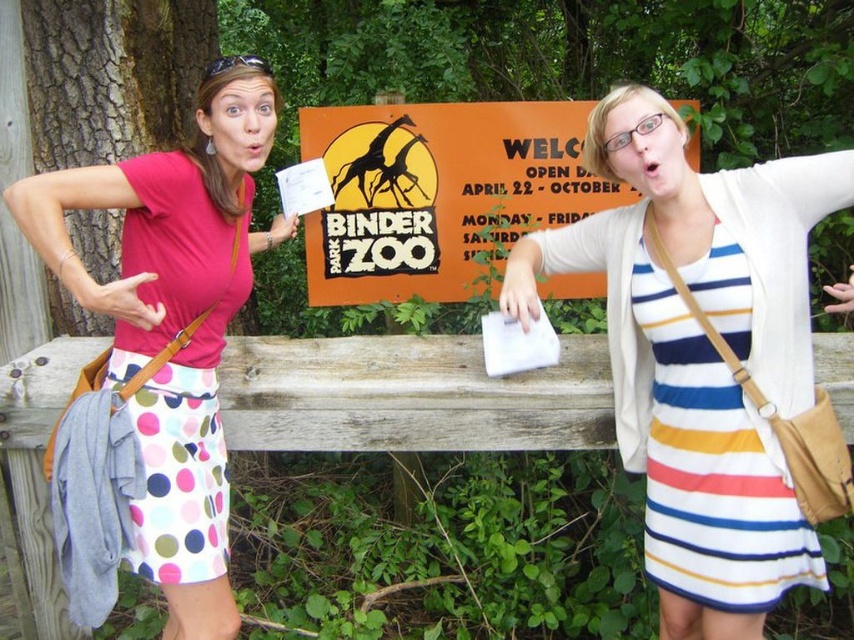
Which of these two, striped cotton dress at center or pink fabric shirt at left, stands taller?

pink fabric shirt at left is taller.

Which is above, striped cotton dress at center or pink fabric shirt at left?

striped cotton dress at center is higher up.

Is point (647, 298) closer to camera compared to point (72, 198)?

No, (647, 298) is further to viewer.

You are a GUI agent. You are given a task and a screenshot of the screen. Output one action in this format:
    pyautogui.click(x=<x>, y=<y>)
    Task: Click on the striped cotton dress at center
    Image resolution: width=854 pixels, height=640 pixels.
    Given the screenshot: What is the action you would take?
    pyautogui.click(x=700, y=355)

Is striped cotton dress at center below orange matte sign at center?

Indeed, striped cotton dress at center is positioned under orange matte sign at center.

Is striped cotton dress at center further to the viewer compared to orange matte sign at center?

No, it is in front of orange matte sign at center.

Between point (819, 184) and point (542, 138), which one is positioned in front?

Point (819, 184) is in front.

I want to click on striped cotton dress at center, so click(x=700, y=355).

The width and height of the screenshot is (854, 640). Describe the element at coordinates (174, 317) in the screenshot. I see `pink fabric shirt at left` at that location.

Looking at this image, is pink fabric shirt at left to the right of orange matte sign at center from the viewer's perspective?

Incorrect, pink fabric shirt at left is not on the right side of orange matte sign at center.

The image size is (854, 640). What do you see at coordinates (174, 317) in the screenshot? I see `pink fabric shirt at left` at bounding box center [174, 317].

Locate an element on the screen. This screenshot has height=640, width=854. pink fabric shirt at left is located at coordinates (174, 317).